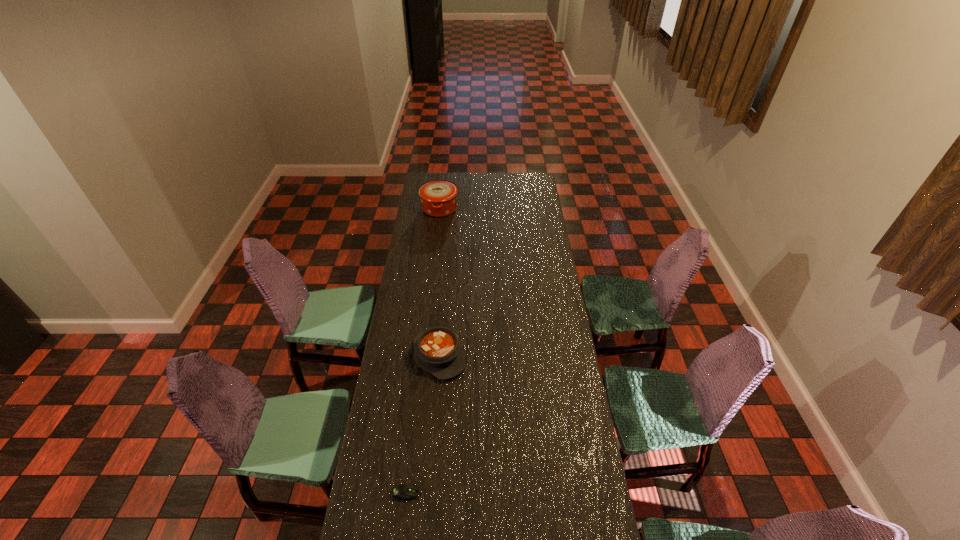
This screenshot has height=540, width=960. I want to click on free space at the far edge of the desktop, so click(509, 189).

Where is `free space at the left edge of the desktop`? free space at the left edge of the desktop is located at coordinates (400, 377).

I want to click on vacant position at the right edge of the desktop, so 548,440.

At what (x,y) coordinates should I click in order to perform the action: click on vacant area at the far right corner of the desktop. Please return your answer as a coordinate pair (x, y). Image resolution: width=960 pixels, height=540 pixels. Looking at the image, I should click on (535, 174).

Identify the location of free space between the second farthest object and the computer mouse. (422, 424).

This screenshot has width=960, height=540. I want to click on empty location between the shortest object and the second shortest object, so click(x=422, y=424).

The width and height of the screenshot is (960, 540). What are the coordinates of `vacant point located between the shortest object and the second farthest object` in the screenshot? It's located at (422, 424).

Image resolution: width=960 pixels, height=540 pixels. Identify the location of vacant region between the second farthest object and the computer mouse. (422, 424).

Find the location of `free space between the nearer casserole and the computer mouse`. free space between the nearer casserole and the computer mouse is located at coordinates (422, 424).

Locate an element on the screen. The image size is (960, 540). unoccupied position between the shortest object and the shorter casserole is located at coordinates pyautogui.click(x=422, y=424).